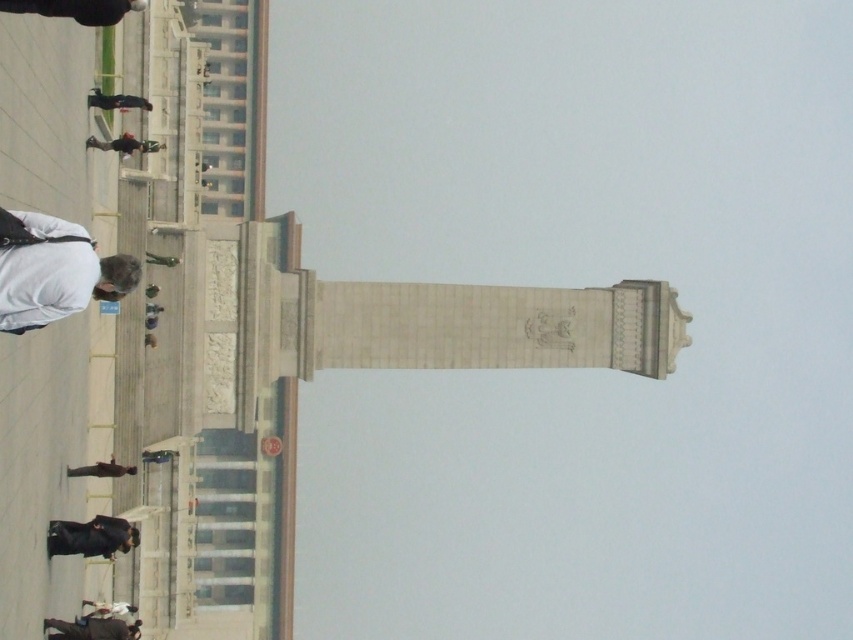
Question: Which point is farther from the camera taking this photo?

Choices:
 (A) (0, 296)
 (B) (155, 262)
 (C) (163, 124)
 (D) (126, 154)

Answer: (C)

Question: Which point appears farthest from the camera in this image?

Choices:
 (A) (97, 99)
 (B) (148, 253)
 (C) (173, 269)
 (D) (94, 476)

Answer: (B)

Question: Considering the relative positions of dark blue jacket at upper left and green fabric person at lower left in the image provided, where is dark blue jacket at upper left located with respect to green fabric person at lower left?

Choices:
 (A) below
 (B) above

Answer: (B)

Question: From the image, what is the correct spatial relationship of white matte skateboard at lower left in relation to dark gray fabric jacket at lower center?

Choices:
 (A) below
 (B) above

Answer: (B)

Question: Based on their relative distances, which object is farther from the dark gray fabric jacket at lower center?

Choices:
 (A) black matte skateboard at center
 (B) white stone tower at center
 (C) dark blue jacket at upper left

Answer: (B)

Question: Can you confirm if white stone tower at center is thinner than white matte skateboard at lower left?

Choices:
 (A) no
 (B) yes

Answer: (A)